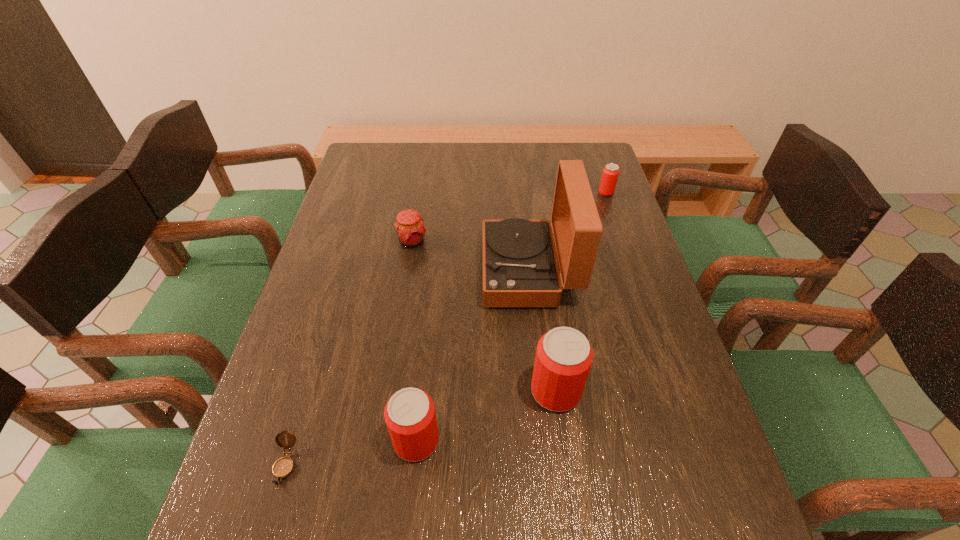
You are a GUI agent. You are given a task and a screenshot of the screen. Output one action in this format:
    pyautogui.click(x=<x>, y=<y>)
    Task: Click on the free spot located 0.300m on the back of the second farthest beer can
    
    Given the screenshot: What is the action you would take?
    pyautogui.click(x=540, y=273)

Locate an element on the screen. The image size is (960, 540). vacant space located on the front of the jam is located at coordinates (400, 313).

Where is `free space located on the front of the rightmost beer can`? The width and height of the screenshot is (960, 540). free space located on the front of the rightmost beer can is located at coordinates (618, 231).

Identify the location of vacant position located on the face of the phonograph record. The image size is (960, 540). (356, 271).

Find the location of a particular element. The image size is (960, 540). free point located on the face of the phonograph record is located at coordinates (333, 271).

You are a GUI agent. You are given a task and a screenshot of the screen. Output one action in this format:
    pyautogui.click(x=<x>, y=<y>)
    Task: Click on the blank area located 0.080m on the face of the phonograph record
    This screenshot has height=540, width=960.
    Given the screenshot: What is the action you would take?
    pyautogui.click(x=452, y=271)

Where is `beer can that is at the near edge`? This screenshot has width=960, height=540. beer can that is at the near edge is located at coordinates (410, 416).

At what (x,y) coordinates should I click in order to perform the action: click on compass at the near edge. Please return your answer as a coordinate pair (x, y). The image size is (960, 540). Looking at the image, I should click on (283, 467).

The image size is (960, 540). Find the location of `object that is at the left edge`. object that is at the left edge is located at coordinates (283, 467).

Find the location of a particular element. The width and height of the screenshot is (960, 540). object that is at the right edge is located at coordinates (610, 174).